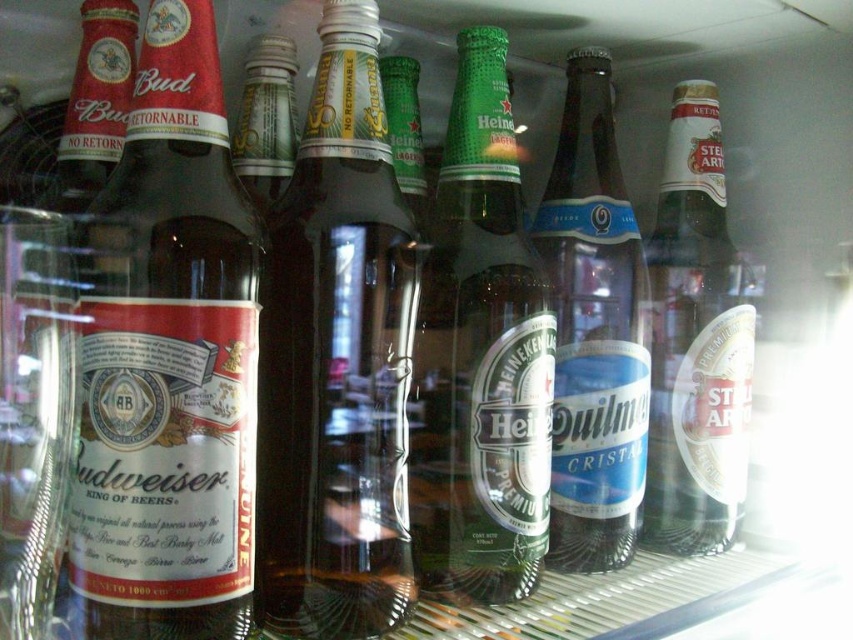
You are organizing bottles in a refrigerator. You have a brown glass bottle at center and a clear glass bottle at right. Which one has a smaller diameter?

The brown glass bottle at center is thinner than the clear glass bottle at right, so the brown glass bottle at center has a smaller diameter.

You are looking at two bottles in the cooler. The matte glass bottle at left and the clear glass bottle at right. Which one is positioned lower in the cooler?

The matte glass bottle at left is located below the clear glass bottle at right, so it is positioned lower in the cooler.